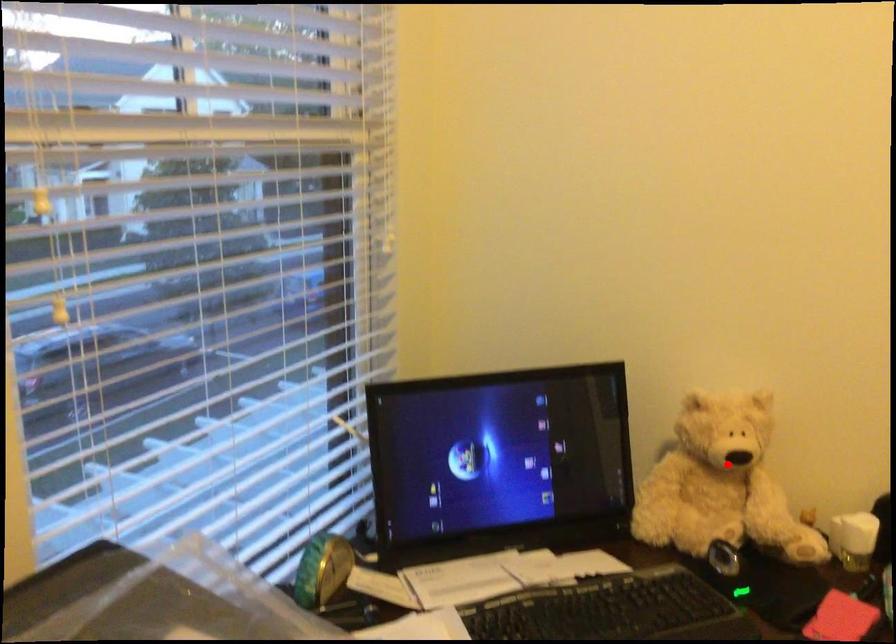
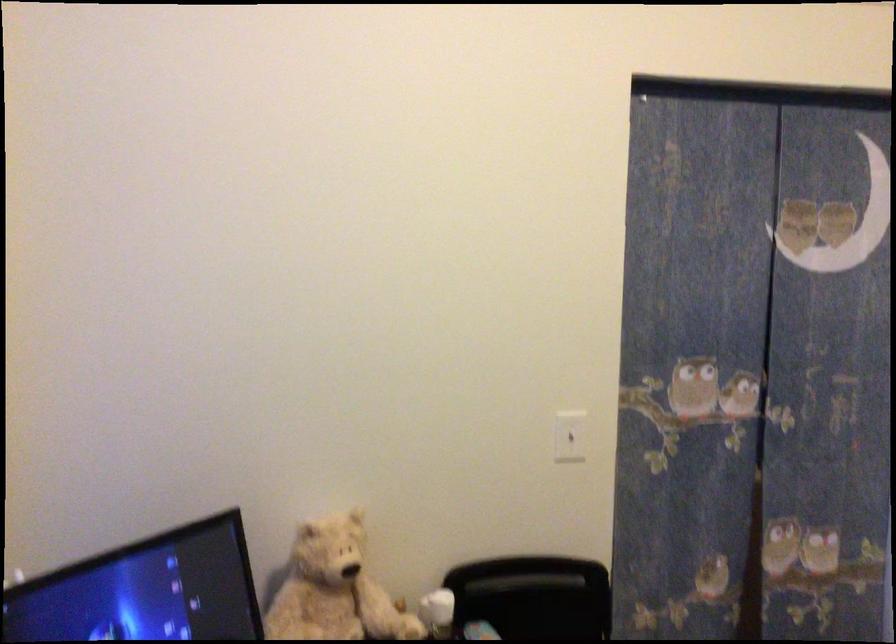
Question: A red point is marked in image1. In image2, is the corresponding 3D point closer to the camera or farther? Reply with the corresponding letter.

Choices:
 (A) The corresponding 3D point is closer.
 (B) The corresponding 3D point is farther.

Answer: (B)